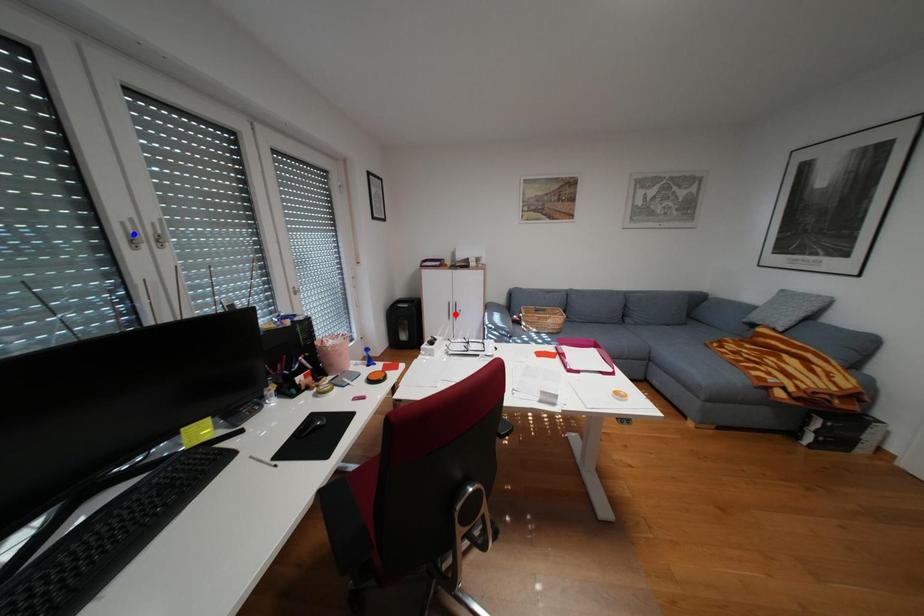
Question: Two points are marked on the image. Which point is closer to the camera?

Choices:
 (A) Blue point is closer.
 (B) Red point is closer.

Answer: (A)